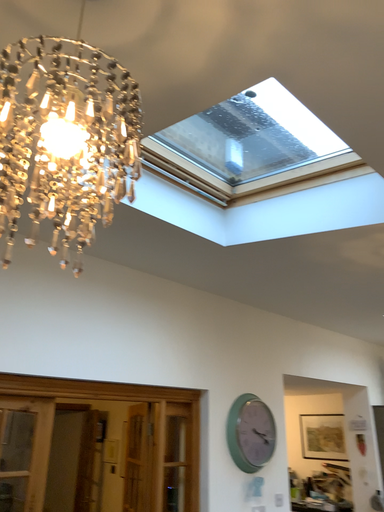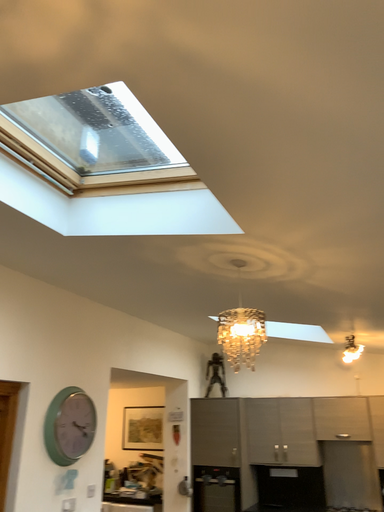
Question: Which way did the camera rotate in the video?

Choices:
 (A) rotated right
 (B) rotated left

Answer: (A)